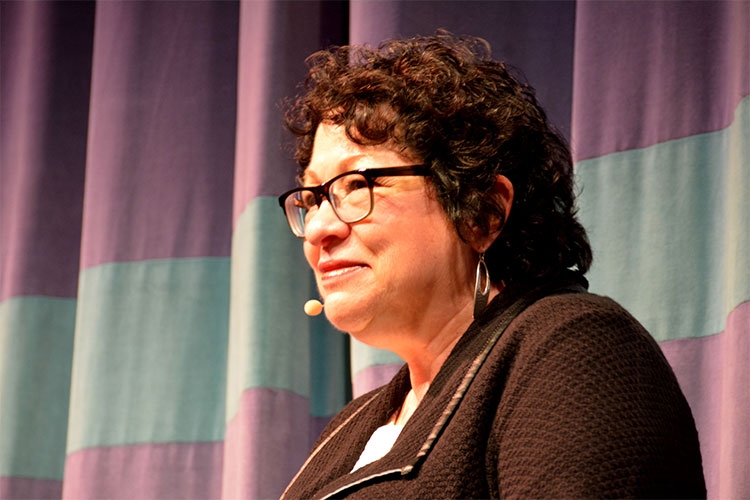
You are a GUI agent. You are given a task and a screenshot of the screen. Output one action in this format:
    pyautogui.click(x=<x>, y=<y>)
    Task: Click on the blue curtain
    The width and height of the screenshot is (750, 500).
    Given the screenshot: What is the action you would take?
    pyautogui.click(x=154, y=345)